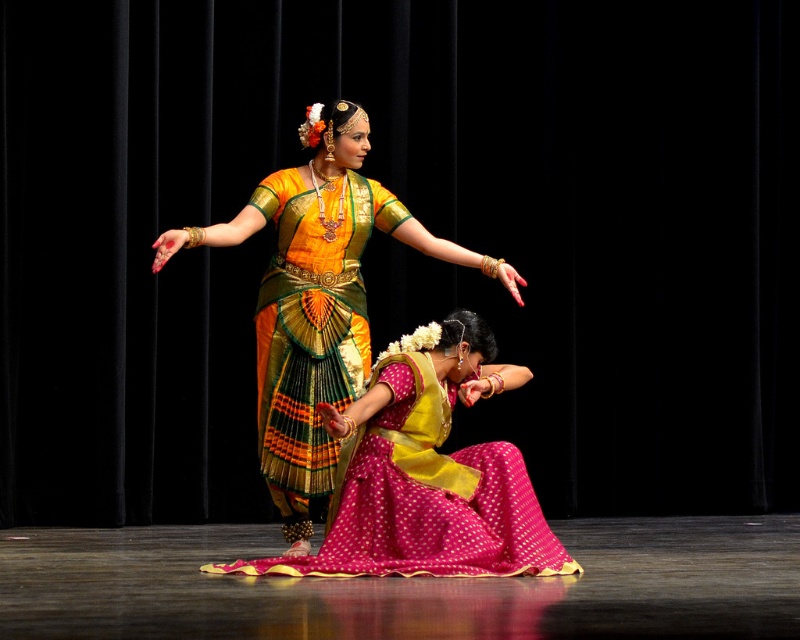
Is pink satin saree at center closer to the viewer compared to golden silk saree at center?

Yes.

Which is in front, point (468, 500) or point (330, 106)?

Point (468, 500) is in front.

Between point (380, 355) and point (308, 172), which one is positioned in front?

Point (380, 355) is in front.

Image resolution: width=800 pixels, height=640 pixels. I want to click on pink satin saree at center, so click(x=424, y=474).

Can you confirm if pink satin saree at center is shorter than shiny silk saree at center?

Yes, pink satin saree at center is shorter than shiny silk saree at center.

Does pink satin saree at center have a lesser width compared to shiny silk saree at center?

Incorrect, pink satin saree at center's width is not less than shiny silk saree at center's.

Locate an element on the screen. Image resolution: width=800 pixels, height=640 pixels. pink satin saree at center is located at coordinates (424, 474).

At what (x,y) coordinates should I click in order to perform the action: click on pink satin saree at center. Please return your answer as a coordinate pair (x, y). The image size is (800, 640). Looking at the image, I should click on (424, 474).

Can you confirm if golden silk saree at center is positioned below shiny silk saree at center?

Incorrect, golden silk saree at center is not positioned below shiny silk saree at center.

Between golden silk saree at center and shiny silk saree at center, which one appears on the left side from the viewer's perspective?

Positioned to the left is shiny silk saree at center.

Is point (318, 317) closer to camera compared to point (277, 300)?

No, (318, 317) is further to viewer.

What are the coordinates of `golden silk saree at center` in the screenshot? It's located at (316, 298).